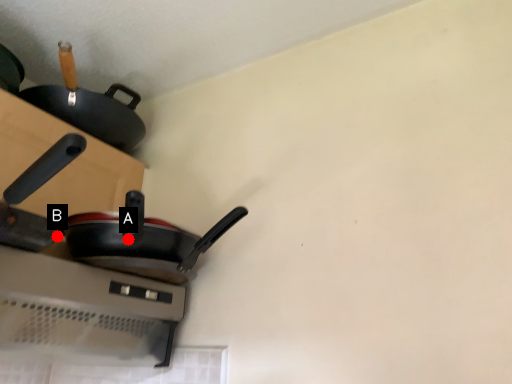
Question: Two points are circled on the image, labeled by A and B beside each circle. Which point appears farthest from the camera in this image?

Choices:
 (A) A is further
 (B) B is further

Answer: (A)